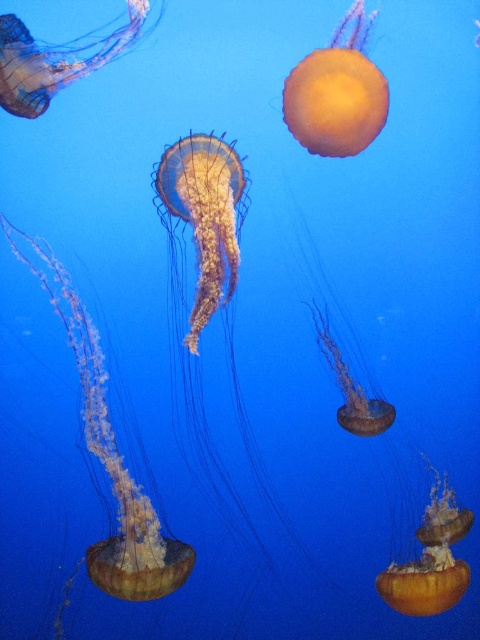
You are an underwater photographer aiming to capture a shot of both the translucent yellow jellyfish at left and the translucent yellow jellyfish at center. Since you want them both in your frame, which jellyfish is positioned more to the left?

The translucent yellow jellyfish at left is positioned more to the left than the translucent yellow jellyfish at center.

From the picture: You are an underwater photographer aiming to capture a shot of the translucent yellow jellyfish at left. Your camera is currently focused on the point at coordinates point (109, 460). Is this point the correct location to focus on to capture the jellyfish?

Yes, the point (109, 460) corresponds to the location of the translucent yellow jellyfish at left, so focusing there will capture the jellyfish.

You are a marine biologist observing this underwater scene. You need to collect samples from both the translucent yellow jellyfish at left and the translucent orange jellyfish at center. If your collection tool has a maximum reach of 50 centimeters, can you reach both jellyfish without moving closer?

The translucent yellow jellyfish at left is 51.79 centimeters away from the translucent orange jellyfish at center. Since the distance between them exceeds the tool reach of 50 centimeters, you cannot reach both jellyfish without moving closer.